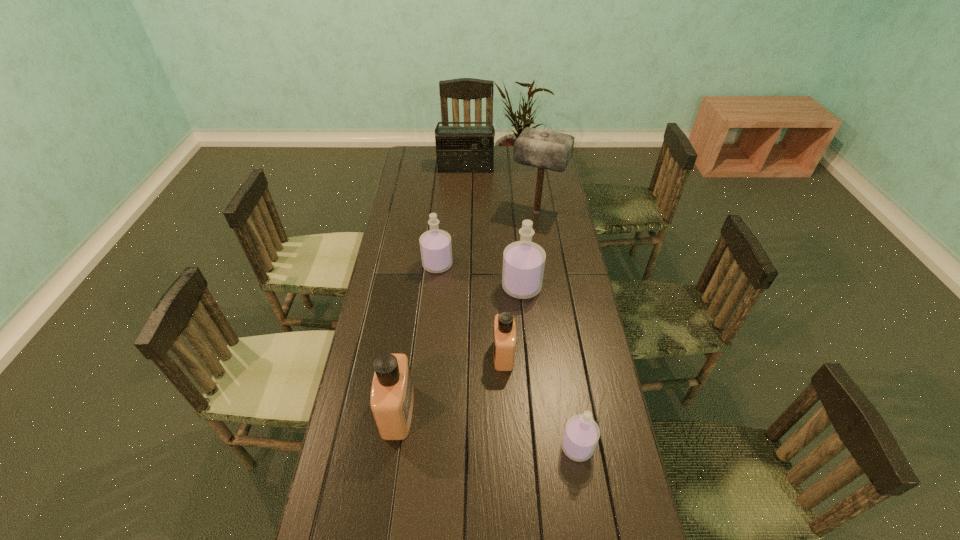
What are the coordinates of `the smallest purple perfume` in the screenshot? It's located at (581, 434).

Identify the location of free space located on the front panel of the gray radio receiver. (464, 216).

This screenshot has width=960, height=540. I want to click on vacant space positioned 0.320m on the back of the mallet, so click(x=529, y=162).

You are a GUI agent. You are given a task and a screenshot of the screen. Output one action in this format:
    pyautogui.click(x=<x>, y=<y>)
    Task: Click on the blank space located 0.180m on the left of the tallest perfume
    The image size is (960, 540).
    Given the screenshot: What is the action you would take?
    pyautogui.click(x=453, y=287)

The image size is (960, 540). I want to click on free region located on the front of the second biggest purple perfume, so click(429, 352).

This screenshot has width=960, height=540. Identify the location of vacant space located on the front label of the bigger beige perfume. (x=486, y=411).

The width and height of the screenshot is (960, 540). Find the location of `vacant space situated 0.110m on the front label of the smaller beige perfume`. vacant space situated 0.110m on the front label of the smaller beige perfume is located at coordinates (459, 354).

I want to click on free region located 0.240m on the front label of the smaller beige perfume, so click(418, 354).

Locate an element on the screen. This screenshot has width=960, height=540. vacant space situated 0.330m on the front label of the smaller beige perfume is located at coordinates (390, 354).

Identify the location of free point located 0.070m on the left of the nearest purple perfume. This screenshot has height=540, width=960. (535, 447).